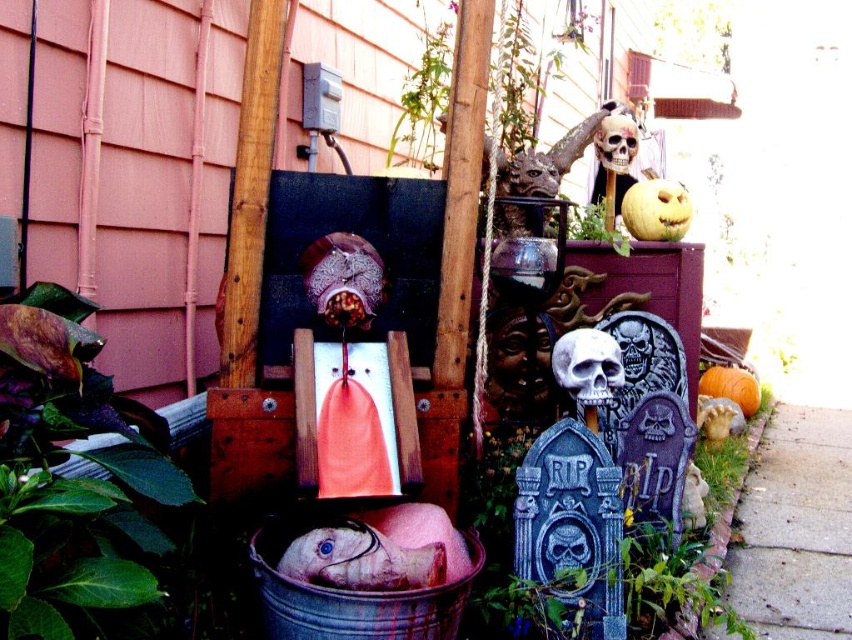
Question: Which of these objects is positioned closest to the smooth orange pumpkin at upper right?

Choices:
 (A) matte plastic skull at upper right
 (B) orange matte pumpkin at lower right

Answer: (A)

Question: Which of these objects is positioned closest to the smooth orange pumpkin at upper right?

Choices:
 (A) matte plastic skull at upper right
 (B) white matte skull at center

Answer: (A)

Question: In this image, where is smooth orange pumpkin at upper right located relative to orange matte pumpkin at lower right?

Choices:
 (A) left
 (B) right

Answer: (A)

Question: Which of these objects is positioned closest to the orange matte pumpkin at lower right?

Choices:
 (A) white matte skull at center
 (B) smooth orange pumpkin at upper right
 (C) matte plastic skull at upper right

Answer: (B)

Question: Is smooth orange pumpkin at upper right above orange matte pumpkin at lower right?

Choices:
 (A) yes
 (B) no

Answer: (A)

Question: Is matte plastic skull at upper right bigger than orange matte pumpkin at lower right?

Choices:
 (A) no
 (B) yes

Answer: (A)